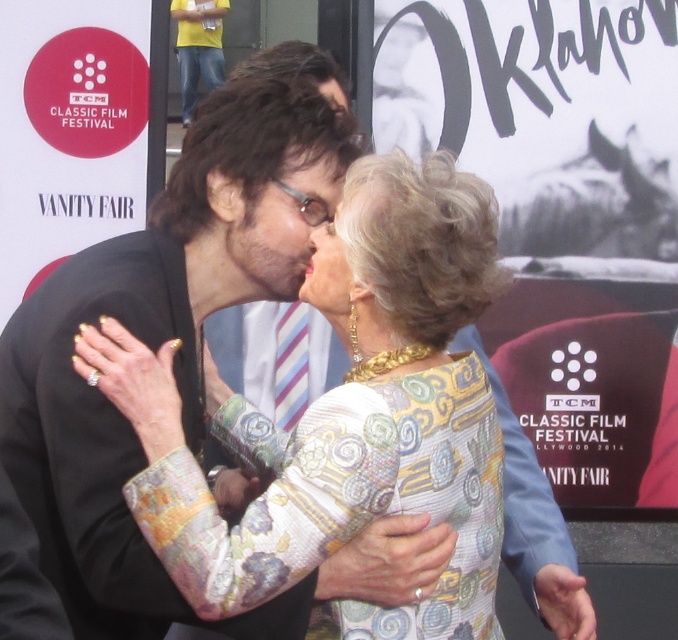
Does matte black face at center have a larger size compared to matte black hair at center?

Yes, matte black face at center is bigger than matte black hair at center.

Consider the image. Does matte black face at center have a greater width compared to matte black hair at center?

Yes, matte black face at center is wider than matte black hair at center.

The image size is (678, 640). Find the location of `matte black face at center`. matte black face at center is located at coordinates (277, 227).

Which of these two, yellow t-shirt at upper left or matte black hair at center, stands taller?

yellow t-shirt at upper left

This screenshot has width=678, height=640. I want to click on yellow t-shirt at upper left, so click(x=199, y=48).

Is yellow t-shirt at upper left thinner than matte gold necklace at center?

In fact, yellow t-shirt at upper left might be wider than matte gold necklace at center.

Based on the photo, who is more forward, (195, 45) or (315, 276)?

Positioned in front is point (315, 276).

Is point (210, 36) closer to camera compared to point (313, 241)?

No, it is behind (313, 241).

Locate an element on the screen. The image size is (678, 640). yellow t-shirt at upper left is located at coordinates (199, 48).